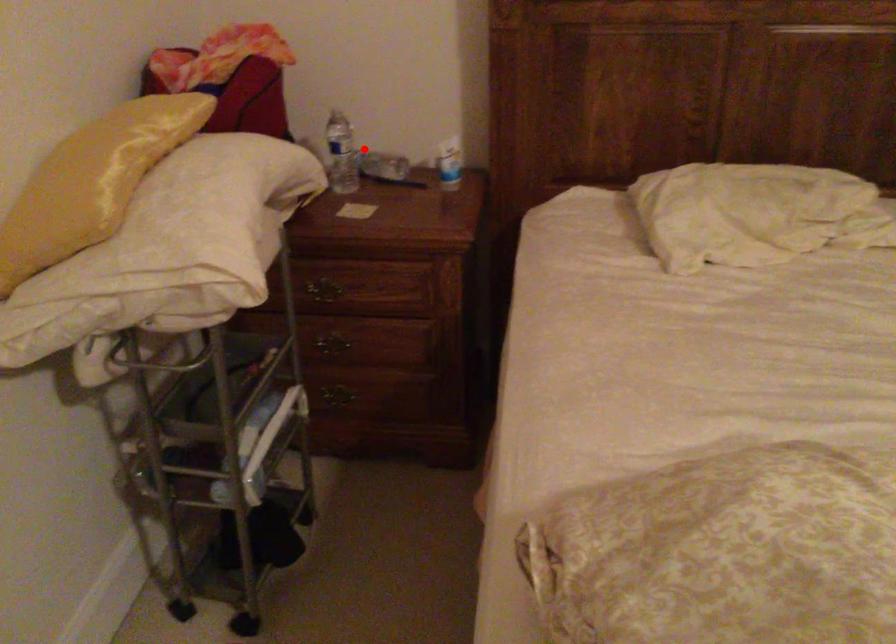
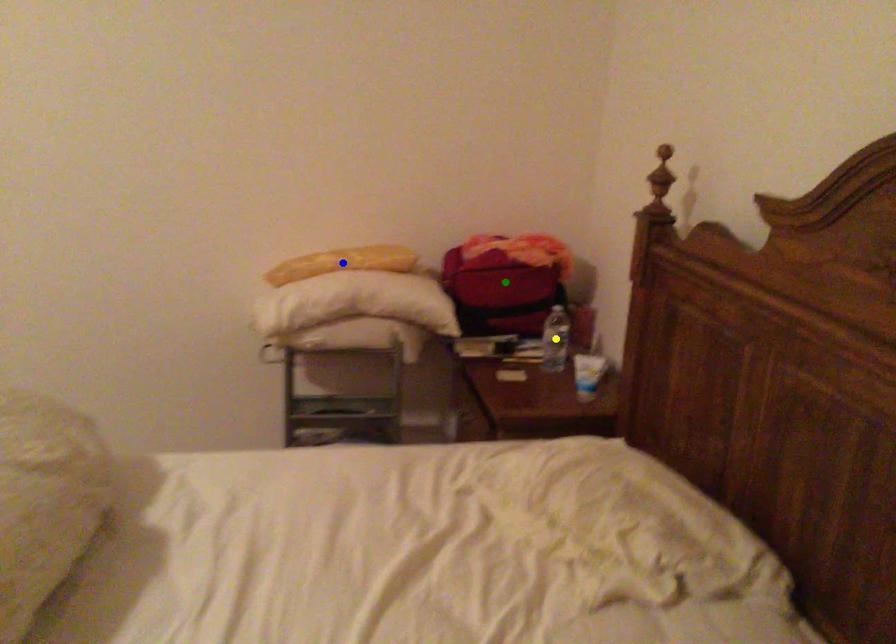
Question: I am providing you with two images of the same scene from different viewpoints. A red point is marked on the first image. You are given multiple points on the second image. Which point in image 2 represents the same 3d spot as the red point in image 1?

Choices:
 (A) blue point
 (B) green point
 (C) yellow point

Answer: (C)